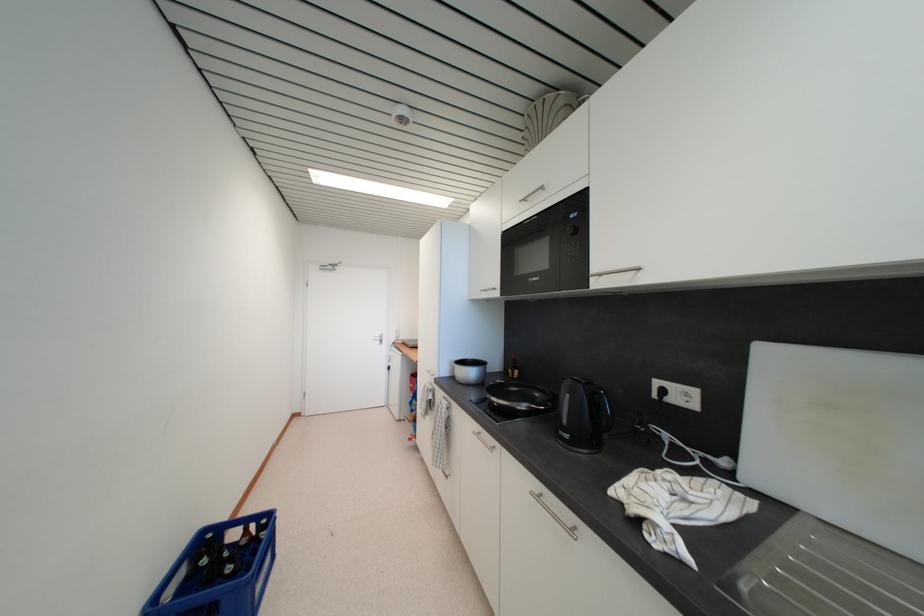
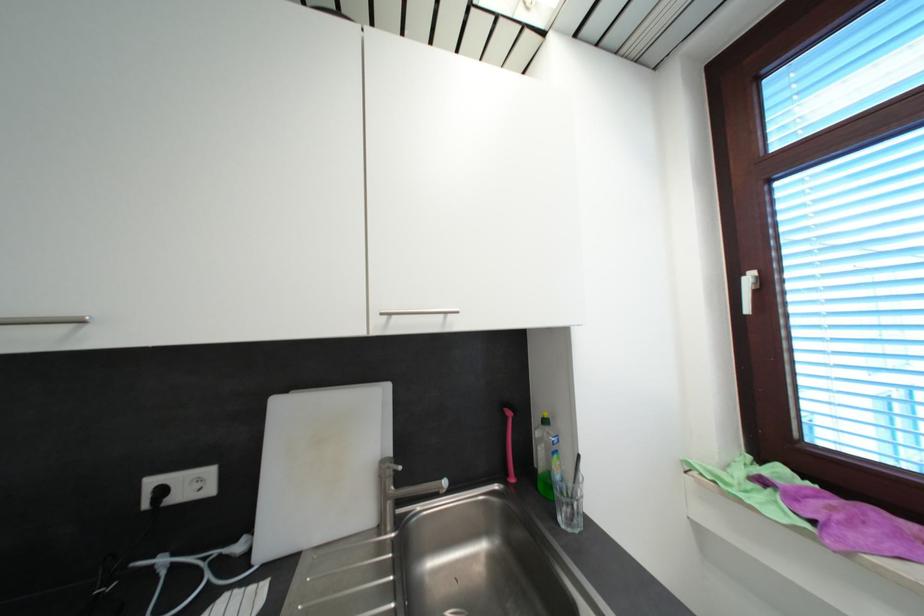
In the second image, find the point that corresponds to the point at 751,483 in the first image.

(265, 559)